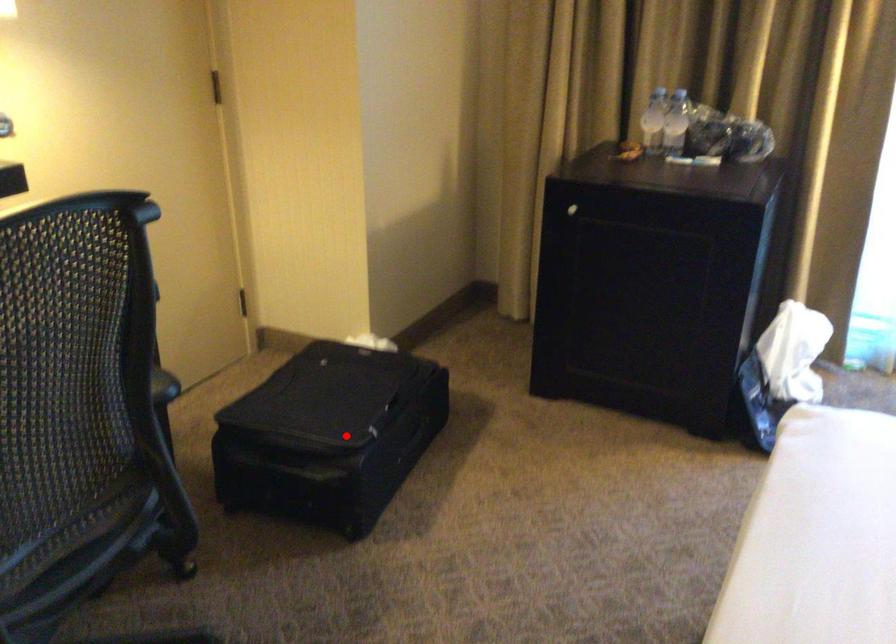
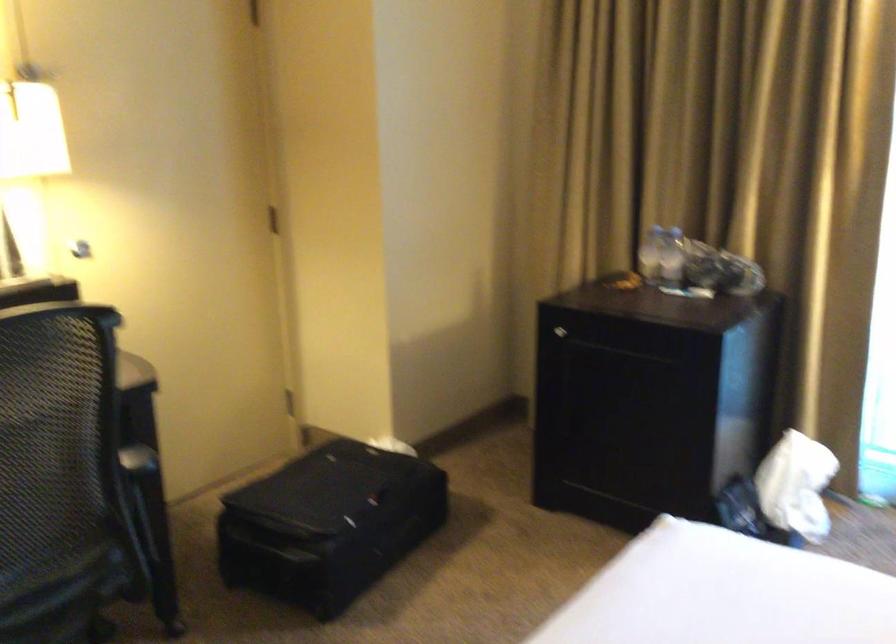
Where in the second image is the point corresponding to the highlighted location from the first image?

(328, 524)